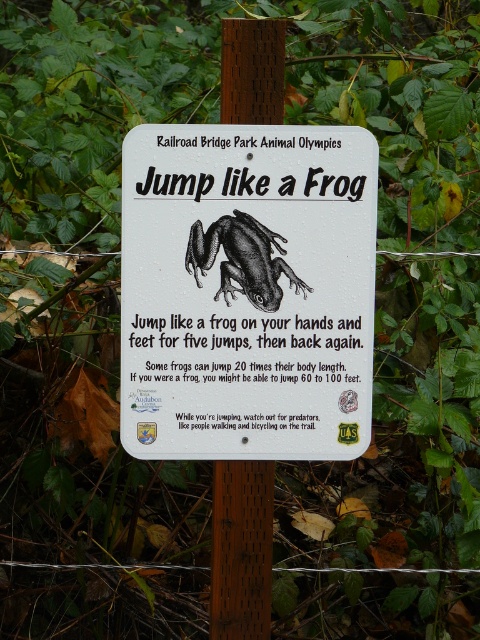
Question: Among these points, which one is farthest from the camera?

Choices:
 (A) (236, 456)
 (B) (264, 275)

Answer: (A)

Question: Is brown wood post at center to the left of black matte frog at center from the viewer's perspective?

Choices:
 (A) yes
 (B) no

Answer: (A)

Question: Can you confirm if white plastic sign at center is wider than brown wood post at center?

Choices:
 (A) no
 (B) yes

Answer: (B)

Question: Among these objects, which one is farthest from the camera?

Choices:
 (A) white plastic sign at center
 (B) black matte frog at center

Answer: (B)

Question: Among these objects, which one is farthest from the camera?

Choices:
 (A) white plastic sign at center
 (B) brown wood post at center

Answer: (B)

Question: Can you confirm if white plastic sign at center is positioned to the right of brown wood post at center?

Choices:
 (A) yes
 (B) no

Answer: (A)